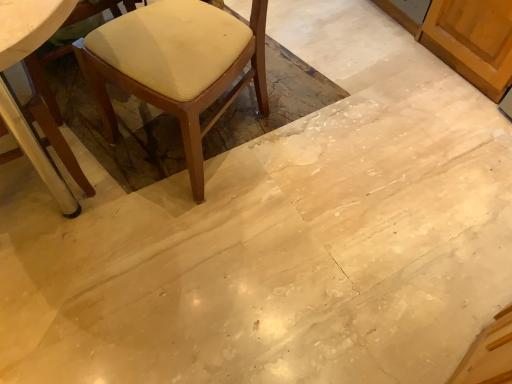
Image resolution: width=512 pixels, height=384 pixels. I want to click on vacant space to the right of matte beige cushioned chair at left, arranged as the first chair when viewed from the right, so click(323, 141).